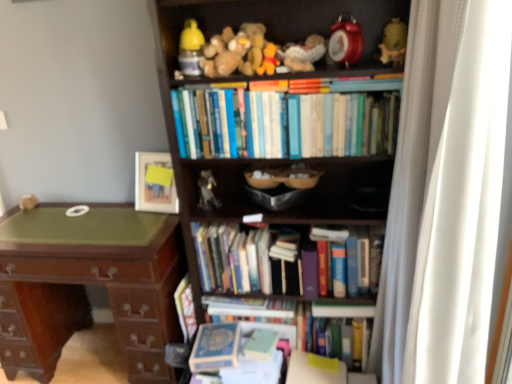
Identify the location of free spot to the right of white plush toy at left, the ninth toy from the right. (55, 206).